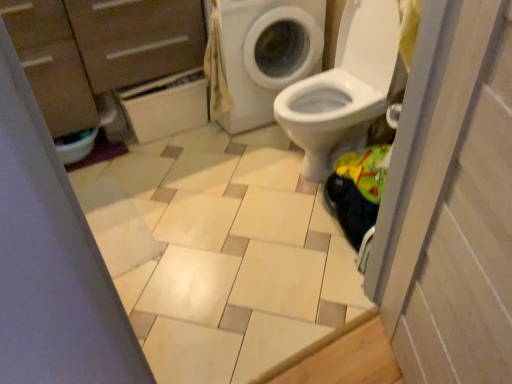
Question: Looking at the image, does brown wood dresser at upper left seem bigger or smaller compared to white matte cabinet at upper left?

Choices:
 (A) small
 (B) big

Answer: (B)

Question: From a real-world perspective, is brown wood dresser at upper left positioned above or below white matte cabinet at upper left?

Choices:
 (A) below
 (B) above

Answer: (B)

Question: Considering the real-world distances, which object is farthest from the white glossy washing machine at upper right?

Choices:
 (A) brown wood dresser at upper left
 (B) beige glossy tile at center
 (C) white matte cabinet at upper left
 (D) white glossy screen door at right

Answer: (D)

Question: Which of these objects is positioned farthest from the white matte cabinet at upper left?

Choices:
 (A) beige glossy tile at center
 (B) white glossy washing machine at upper right
 (C) white glossy screen door at right
 (D) brown wood dresser at upper left

Answer: (C)